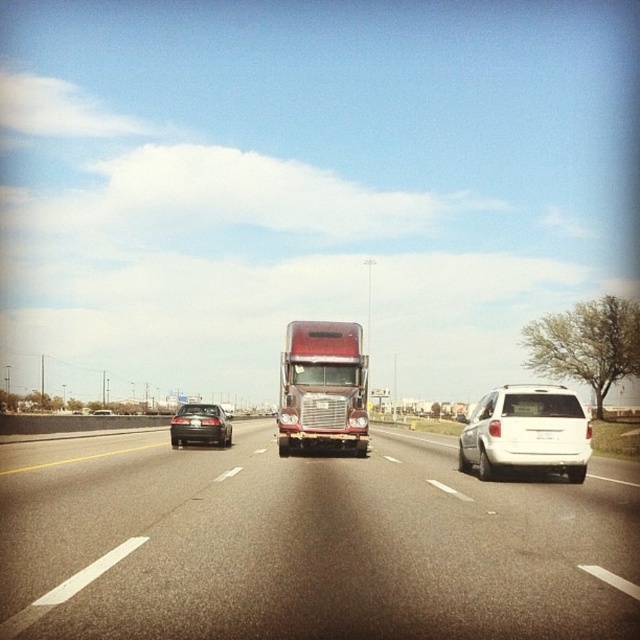
Question: Can you confirm if metallic red semi-truck at center is bigger than shiny black sedan at center?

Choices:
 (A) yes
 (B) no

Answer: (B)

Question: Considering the real-world distances, which object is farthest from the metallic silver truck at center?

Choices:
 (A) shiny black sedan at center
 (B) white matte suv at right
 (C) white plastic license plate at center
 (D) metallic red semi-truck at center

Answer: (A)

Question: Does metallic silver truck at center have a lesser width compared to white plastic license plate at center?

Choices:
 (A) no
 (B) yes

Answer: (A)

Question: Does white plastic license plate at center have a larger size compared to shiny black sedan at center?

Choices:
 (A) yes
 (B) no

Answer: (B)

Question: Based on their relative distances, which object is farther from the shiny black sedan at center?

Choices:
 (A) metallic red semi-truck at center
 (B) metallic silver truck at center

Answer: (B)

Question: Estimate the real-world distances between objects in this image. Which object is farther from the metallic silver truck at center?

Choices:
 (A) shiny black sedan at left
 (B) shiny black sedan at center
 (C) white matte suv at right
 (D) metallic red semi-truck at center

Answer: (B)